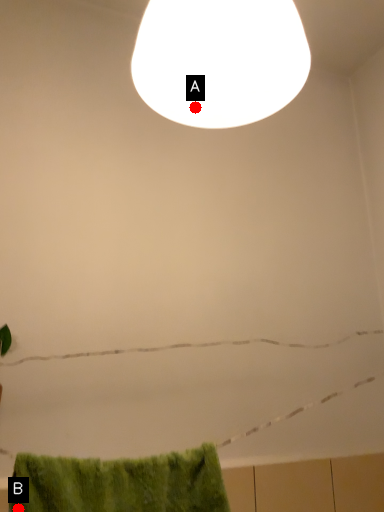
Question: Two points are circled on the image, labeled by A and B beside each circle. Among these points, which one is nearest to the camera?

Choices:
 (A) A is closer
 (B) B is closer

Answer: (B)